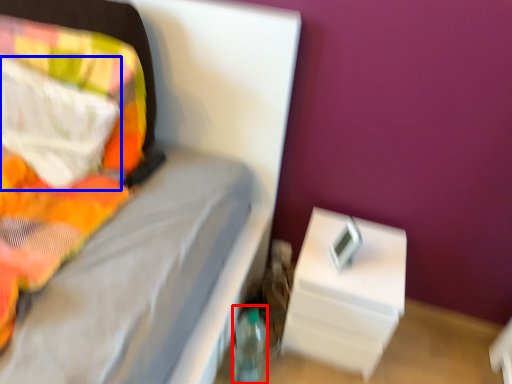
Question: Which point is closer to the camera, bottle (highlighted by a red box) or pillow (highlighted by a blue box)?

Choices:
 (A) bottle
 (B) pillow

Answer: (B)